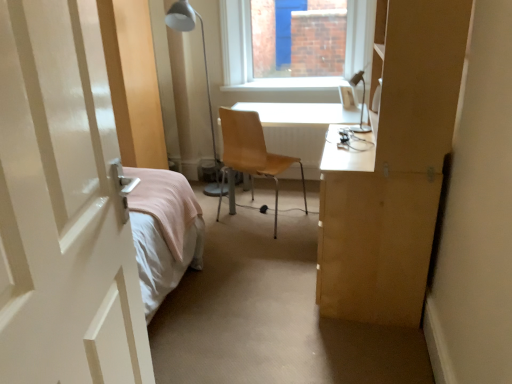
Question: From the image's perspective, is metallic silver table lamp at upper right, the 2th table lamp viewed from the back, located above or below light brown wood chair at center?

Choices:
 (A) above
 (B) below

Answer: (A)

Question: Is point (359, 124) closer or farther from the camera than point (257, 152)?

Choices:
 (A) closer
 (B) farther

Answer: (A)

Question: Estimate the real-world distances between objects in this image. Which object is farther from the metallic silver table lamp at upper right, the 2th table lamp viewed from the back?

Choices:
 (A) white metal table lamp at upper center, the first table lamp in the left-to-right sequence
 (B) white glossy door at left
 (C) light brown wood chair at center
 (D) white glossy desk at center

Answer: (B)

Question: Estimate the real-world distances between objects in this image. Which object is closer to the light brown wood chair at center?

Choices:
 (A) white glossy door at left
 (B) metallic silver table lamp at upper right, which is the second table lamp in left-to-right order
 (C) white metal table lamp at upper center, which appears as the 2th table lamp when viewed from the front
 (D) white glossy desk at center

Answer: (D)